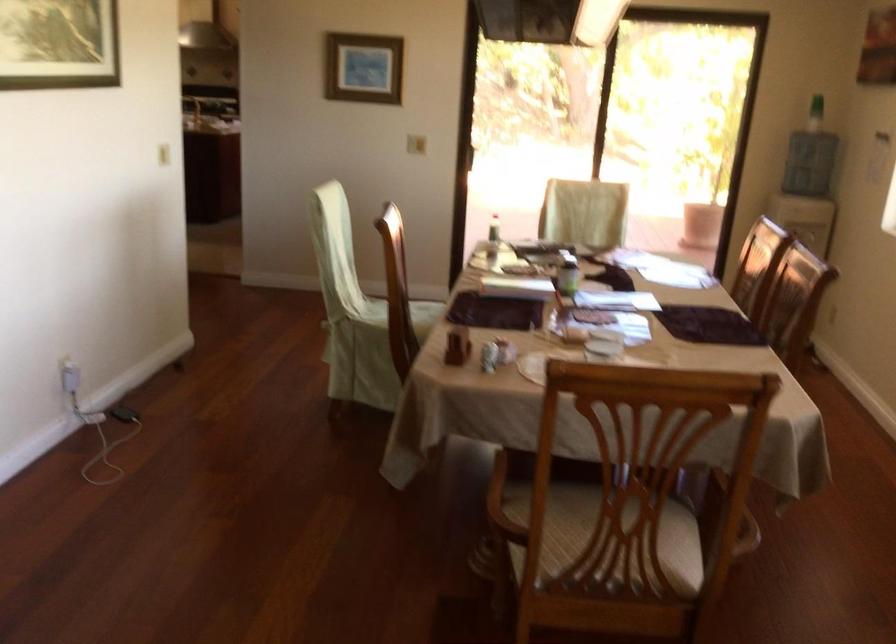
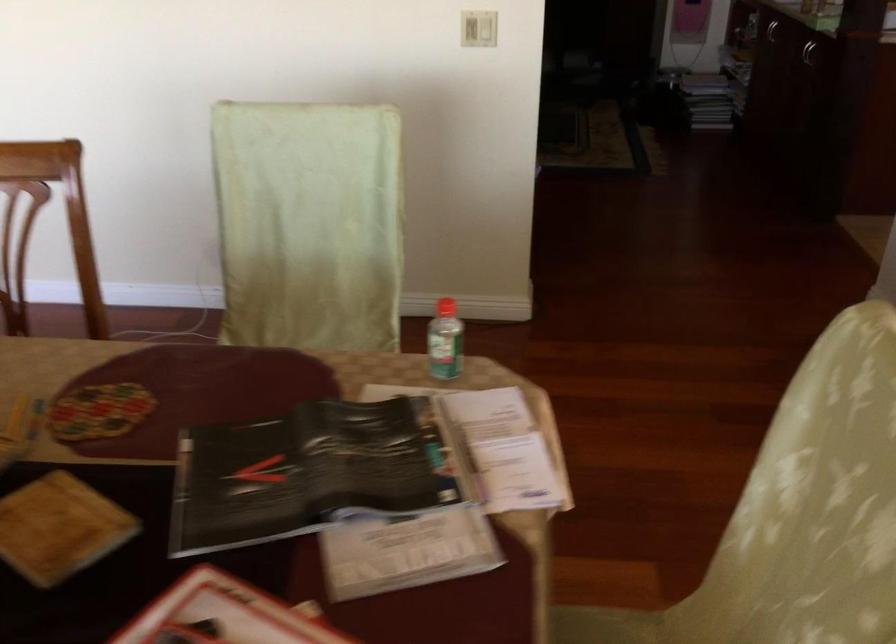
Find the pixel in the second image that matches (x=171, y=154) in the first image.

(478, 29)